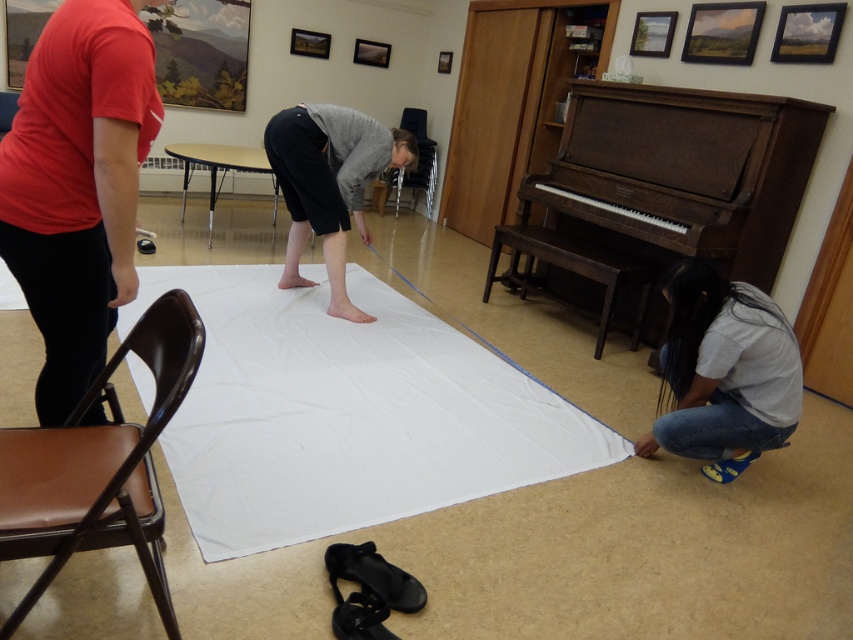
Is white matte cloth at center above brown leather chair at lower left?

Correct, white matte cloth at center is located above brown leather chair at lower left.

Who is more forward, (207, 307) or (53, 572)?

Point (53, 572) is more forward.

Does point (479, 388) come closer to viewer compared to point (157, 532)?

No, (479, 388) is behind (157, 532).

This screenshot has height=640, width=853. In order to click on white matte cloth at center in this screenshot , I will do `click(346, 412)`.

Is brown leather chair at lower left further to the viewer compared to white cotton shirt at lower right?

No, brown leather chair at lower left is in front of white cotton shirt at lower right.

Based on the photo, who is shorter, brown leather chair at lower left or white cotton shirt at lower right?

With less height is brown leather chair at lower left.

Which is behind, point (15, 509) or point (653, 436)?

Point (653, 436)

Image resolution: width=853 pixels, height=640 pixels. Find the location of `brown leather chair at lower left`. brown leather chair at lower left is located at coordinates (99, 465).

Is wooden piano at center right taller than white cotton shirt at lower right?

Yes, wooden piano at center right is taller than white cotton shirt at lower right.

Between wooden piano at center right and white cotton shirt at lower right, which one appears on the left side from the viewer's perspective?

white cotton shirt at lower right

You are a GUI agent. You are given a task and a screenshot of the screen. Output one action in this format:
    pyautogui.click(x=<x>, y=<y>)
    Task: Click on the wooden piano at center right
    The width and height of the screenshot is (853, 640).
    Given the screenshot: What is the action you would take?
    pyautogui.click(x=659, y=196)